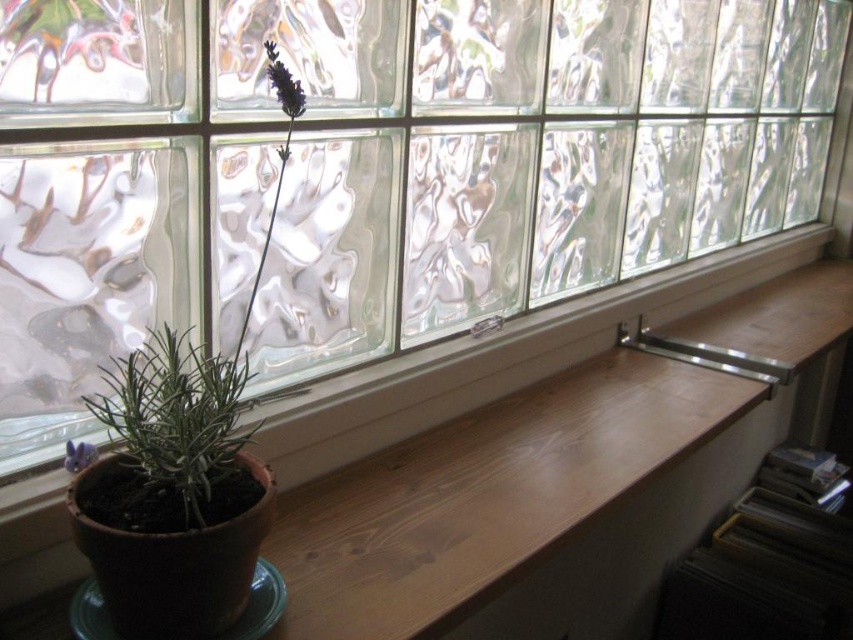
Question: Can you confirm if wooden ledge at lower center is wider than green matte plant at lower left?

Choices:
 (A) yes
 (B) no

Answer: (A)

Question: Among these objects, which one is nearest to the camera?

Choices:
 (A) wooden ledge at lower center
 (B) green matte plant at left

Answer: (B)

Question: Does green matte plant at left have a larger size compared to green matte plant at lower left?

Choices:
 (A) no
 (B) yes

Answer: (B)

Question: Among these points, which one is farthest from the camera?

Choices:
 (A) (206, 401)
 (B) (144, 488)

Answer: (A)

Question: Which of the following is the farthest from the observer?

Choices:
 (A) (519, 426)
 (B) (173, 497)

Answer: (A)

Question: Is wooden ledge at lower center positioned behind green matte plant at lower left?

Choices:
 (A) yes
 (B) no

Answer: (A)